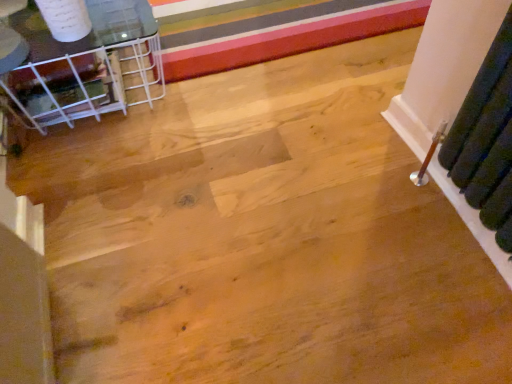
Identify the location of vacant region under multicolored striped carpet at upper center (from a real-world perspective). Image resolution: width=512 pixels, height=384 pixels. (250, 17).